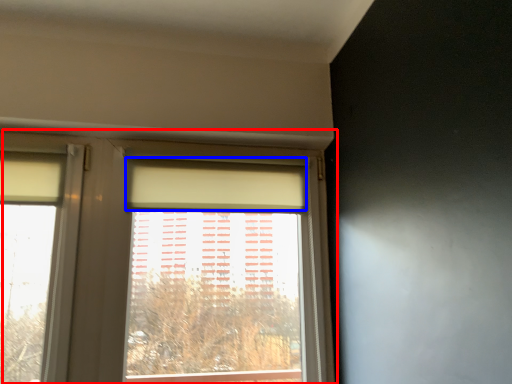
Question: Among these objects, which one is farthest to the camera, window (highlighted by a red box) or curtain (highlighted by a blue box)?

Choices:
 (A) window
 (B) curtain

Answer: (B)